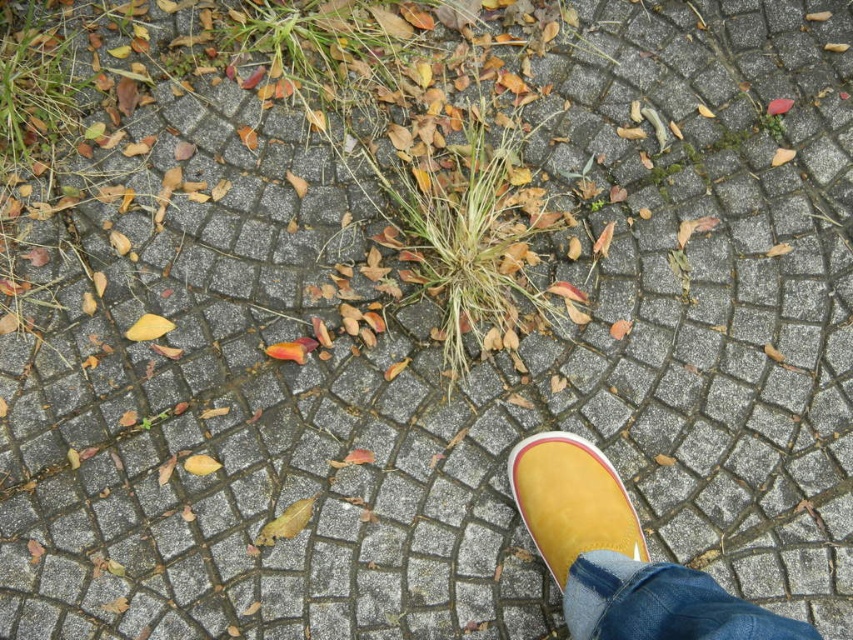
Question: Which object appears closest to the camera in this image?

Choices:
 (A) yellow suede shoe at lower right
 (B) denim at lower right
 (C) yellow rubber boot at lower right

Answer: (B)

Question: Which object appears farthest from the camera in this image?

Choices:
 (A) yellow rubber boot at lower right
 (B) yellow suede shoe at lower right

Answer: (B)

Question: Is denim at lower right positioned behind yellow suede shoe at lower right?

Choices:
 (A) yes
 (B) no

Answer: (B)

Question: Is denim at lower right wider than yellow suede shoe at lower right?

Choices:
 (A) no
 (B) yes

Answer: (B)

Question: Is yellow rubber boot at lower right smaller than yellow suede shoe at lower right?

Choices:
 (A) no
 (B) yes

Answer: (A)

Question: Which object is the farthest from the denim at lower right?

Choices:
 (A) yellow suede shoe at lower right
 (B) yellow rubber boot at lower right

Answer: (A)